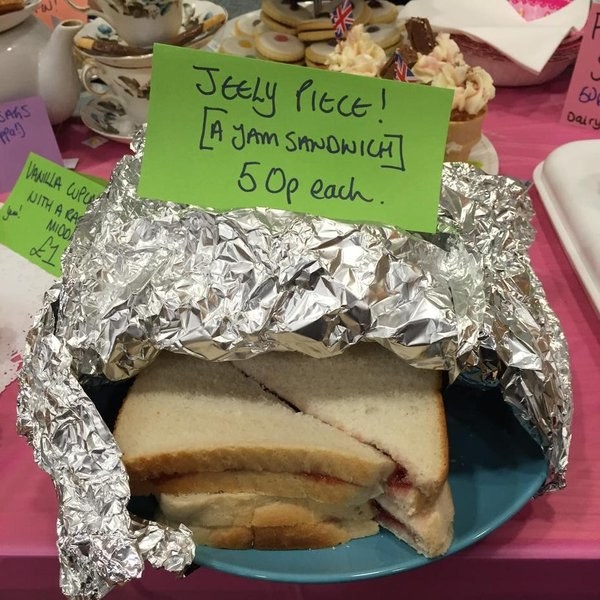
What are the coordinates of `blue plate` in the screenshot? It's located at (286, 562), (485, 490).